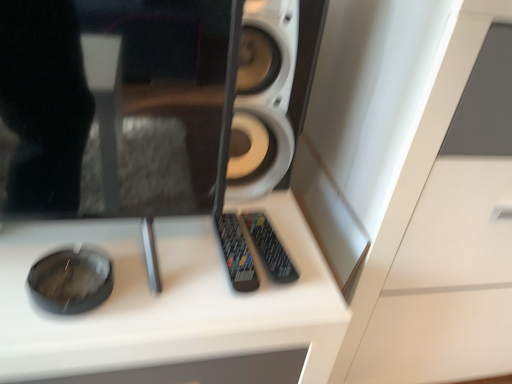
Question: Is white matte speaker at center outside of black plastic remote at center, which is the second control from right to left?

Choices:
 (A) no
 (B) yes

Answer: (B)

Question: Does white matte speaker at center have a lesser height compared to black plastic remote at center, which is the second control from right to left?

Choices:
 (A) no
 (B) yes

Answer: (A)

Question: Considering the relative positions of white matte speaker at center and black plastic remote at center, which is the second control from right to left, in the image provided, is white matte speaker at center to the right of black plastic remote at center, which is the second control from right to left, from the viewer's perspective?

Choices:
 (A) no
 (B) yes

Answer: (B)

Question: From a real-world perspective, is white matte speaker at center on top of black plastic remote at center, arranged as the first control when viewed from the left?

Choices:
 (A) no
 (B) yes

Answer: (B)

Question: From the image's perspective, is white matte speaker at center located above black plastic remote at center, which is the second control from right to left?

Choices:
 (A) no
 (B) yes

Answer: (B)

Question: Based on their positions, is white matte speaker at center located to the left or right of black plastic remote at center, arranged as the 1th control when viewed from the right?

Choices:
 (A) right
 (B) left

Answer: (B)

Question: Is white matte speaker at center situated inside black plastic remote at center, which is counted as the second control, starting from the left, or outside?

Choices:
 (A) inside
 (B) outside

Answer: (B)

Question: Considering their positions, is white matte speaker at center located in front of or behind black plastic remote at center, which is counted as the second control, starting from the left?

Choices:
 (A) front
 (B) behind

Answer: (A)

Question: From a real-world perspective, relative to black plastic remote at center, which is counted as the second control, starting from the left, is white matte speaker at center vertically above or below?

Choices:
 (A) above
 (B) below

Answer: (A)

Question: Is black plastic remote at center, which is the second control from right to left, in front of or behind white glossy dresser at center in the image?

Choices:
 (A) front
 (B) behind

Answer: (B)

Question: Does point (241, 288) appear closer or farther from the camera than point (454, 127)?

Choices:
 (A) closer
 (B) farther

Answer: (A)

Question: Is black plastic remote at center, which is the second control from right to left, to the left or to the right of white glossy dresser at center in the image?

Choices:
 (A) left
 (B) right

Answer: (A)

Question: From the image's perspective, is black plastic remote at center, which is the second control from right to left, positioned above or below white glossy dresser at center?

Choices:
 (A) above
 (B) below

Answer: (B)

Question: Is point (292, 147) positioned closer to the camera than point (452, 354)?

Choices:
 (A) farther
 (B) closer

Answer: (B)

Question: In terms of height, does white matte speaker at center look taller or shorter compared to white glossy dresser at center?

Choices:
 (A) short
 (B) tall

Answer: (A)